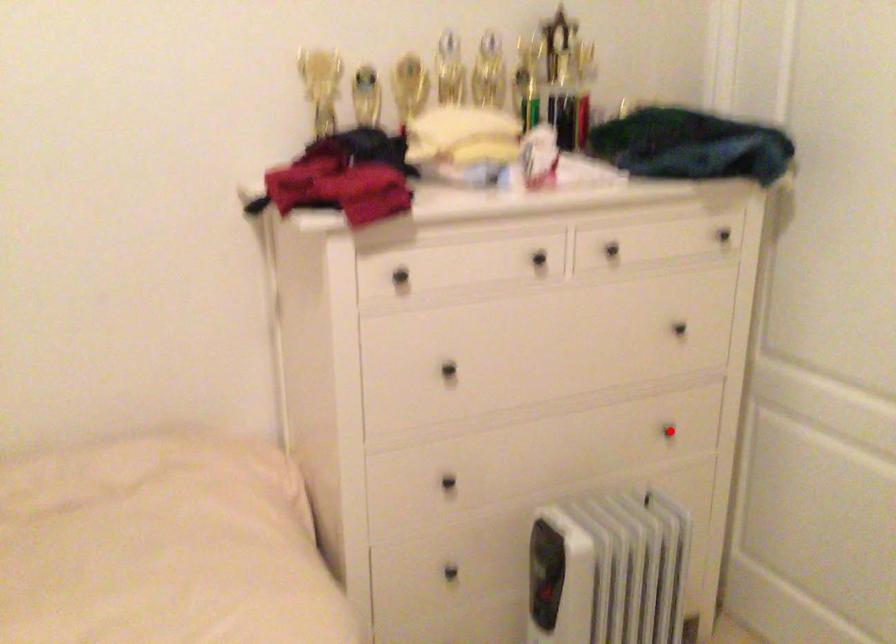
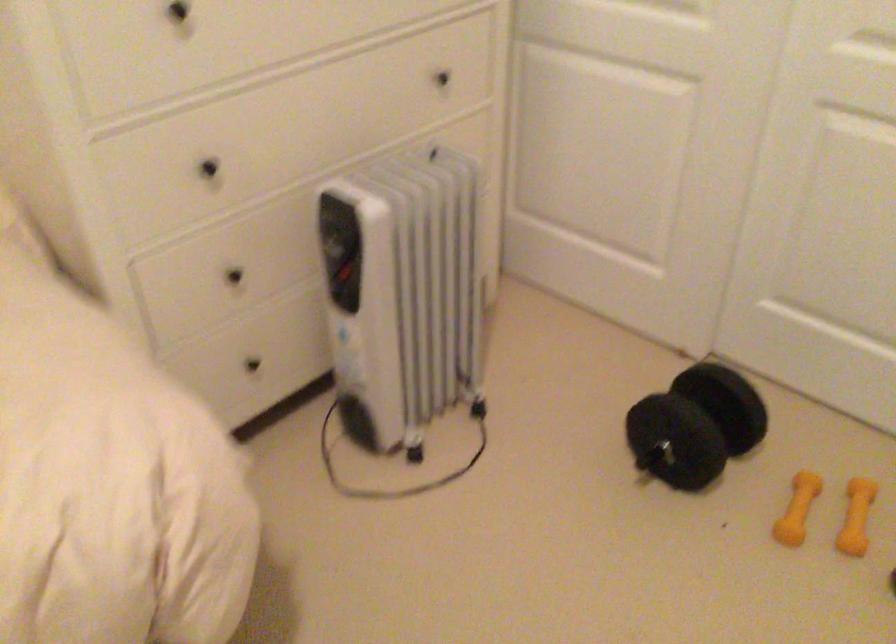
Question: I am providing you with two images of the same scene from different viewpoints. In image1, a red point is highlighted. Considering the same 3D point in image2, which of the following is correct?

Choices:
 (A) It is closer
 (B) It is farther

Answer: (A)